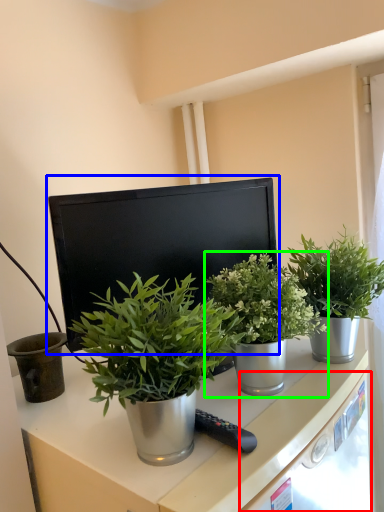
Question: Which is nearer to the drawer (highlighted by a red box)? computer monitor (highlighted by a blue box) or houseplant (highlighted by a green box).

Choices:
 (A) computer monitor
 (B) houseplant

Answer: (B)